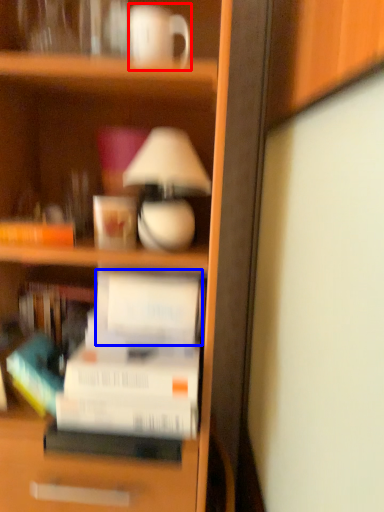
Question: Which point is closer to the camera, coffee cup (highlighted by a red box) or paperback book (highlighted by a blue box)?

Choices:
 (A) coffee cup
 (B) paperback book

Answer: (A)